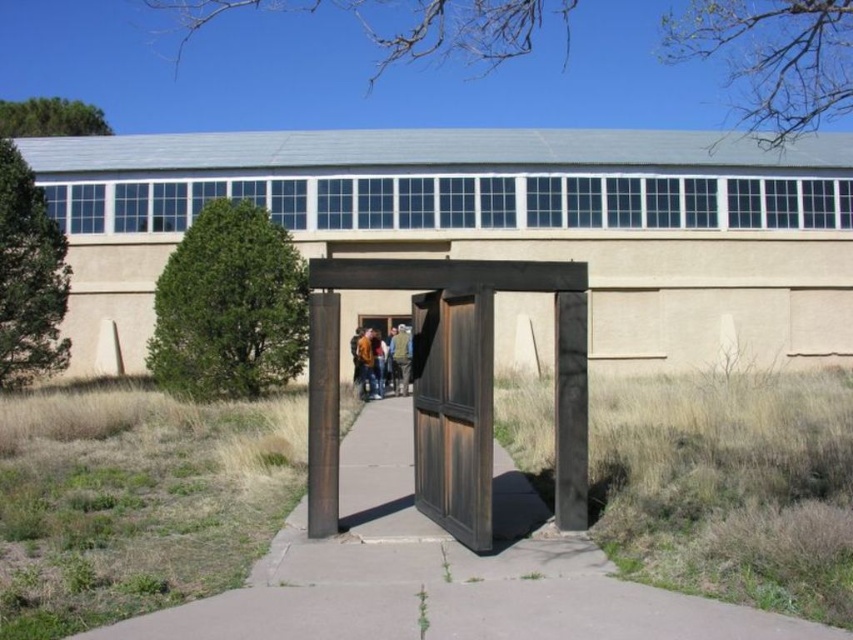
Can you confirm if rustic wood gate at center is positioned to the right of brown concrete pavement at center?

No, rustic wood gate at center is not to the right of brown concrete pavement at center.

In the scene shown: Is rustic wood gate at center to the left of brown concrete pavement at center from the viewer's perspective?

Correct, you'll find rustic wood gate at center to the left of brown concrete pavement at center.

Locate an element on the screen. The image size is (853, 640). rustic wood gate at center is located at coordinates [489, 225].

Which is behind, point (550, 164) or point (358, 376)?

The point (550, 164) is more distant.

Who is lower down, rustic wood gate at center or matte brown jacket at center?

Positioned lower is matte brown jacket at center.

Between point (817, 145) and point (376, 394), which one is positioned behind?

The point (817, 145) is behind.

The image size is (853, 640). In order to click on rustic wood gate at center in this screenshot , I will do `click(489, 225)`.

Which is below, dark wood gate at center or matte brown jacket at center?

Positioned lower is matte brown jacket at center.

Can you confirm if dark wood gate at center is positioned to the right of matte brown jacket at center?

Yes, dark wood gate at center is to the right of matte brown jacket at center.

Which is in front, point (570, 355) or point (368, 332)?

Point (570, 355)

Identify the location of dark wood gate at center. The height and width of the screenshot is (640, 853). (570, 410).